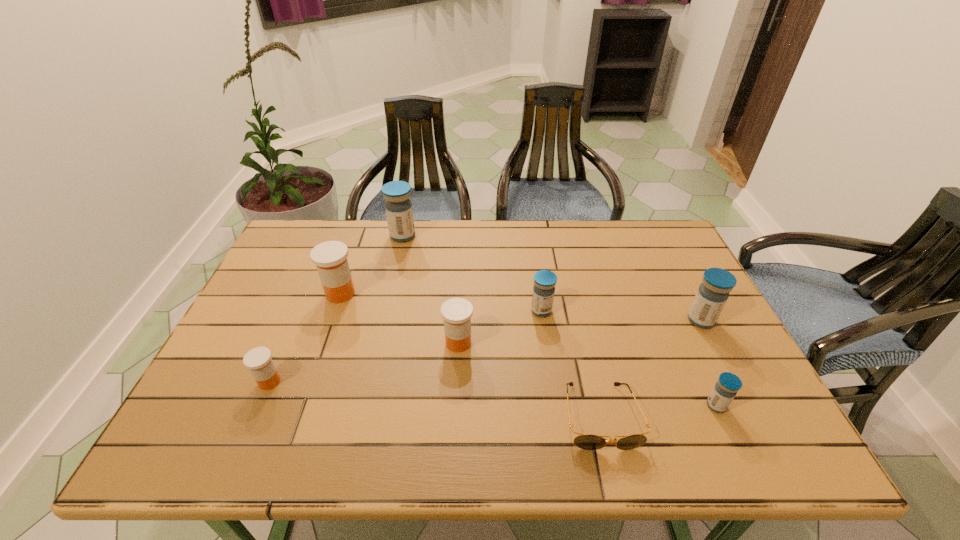
The height and width of the screenshot is (540, 960). Identify the location of the smallest orange medicine. (258, 360).

Locate an element on the screen. The height and width of the screenshot is (540, 960). the leftmost object is located at coordinates (258, 360).

Find the location of a particular element. This screenshot has width=960, height=540. the smallest blue medicine is located at coordinates (728, 384).

You are a GUI agent. You are given a task and a screenshot of the screen. Output one action in this format:
    pyautogui.click(x=<x>, y=<y>)
    Task: Click on the nearest medicine
    This screenshot has width=960, height=540.
    Given the screenshot: What is the action you would take?
    pyautogui.click(x=728, y=384)

The width and height of the screenshot is (960, 540). In order to click on the shortest object in this screenshot , I will do `click(584, 441)`.

The width and height of the screenshot is (960, 540). Identify the location of black sunglasses. (584, 441).

Identify the location of free spot located on the front of the third medicine from left to right. This screenshot has height=540, width=960. (398, 254).

Find the location of `vacant region located 0.090m on the label of the sixth medicine from right to left`. vacant region located 0.090m on the label of the sixth medicine from right to left is located at coordinates (389, 294).

This screenshot has width=960, height=540. I want to click on free space located 0.070m on the left of the rightmost blue medicine, so click(x=660, y=320).

This screenshot has width=960, height=540. Identify the location of free space located on the label of the fourth medicine from right to left. (453, 447).